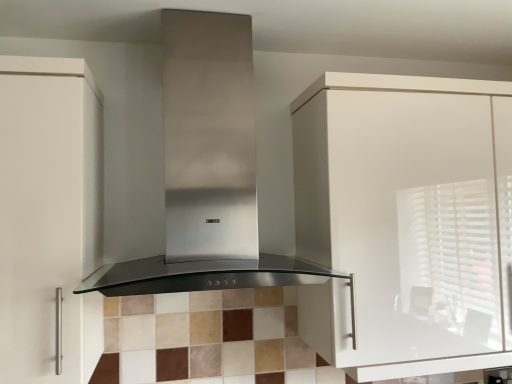
Question: In the image, is stainless steel range hood at center positioned in front of or behind white matte cabinet at left, the second cabinetry viewed from the right?

Choices:
 (A) behind
 (B) front

Answer: (B)

Question: Do you think stainless steel range hood at center is within white matte cabinet at left, the 1th cabinetry viewed from the left, or outside of it?

Choices:
 (A) outside
 (B) inside

Answer: (A)

Question: Which object is positioned closest to the white matte cabinet at left, the 1th cabinetry viewed from the left?

Choices:
 (A) white glossy cabinet at upper right, the 1th cabinetry from the right
 (B) stainless steel range hood at center

Answer: (B)

Question: Based on their relative distances, which object is farther from the white matte cabinet at left, the 1th cabinetry viewed from the left?

Choices:
 (A) white glossy cabinet at upper right, the 1th cabinetry from the right
 (B) stainless steel range hood at center

Answer: (A)